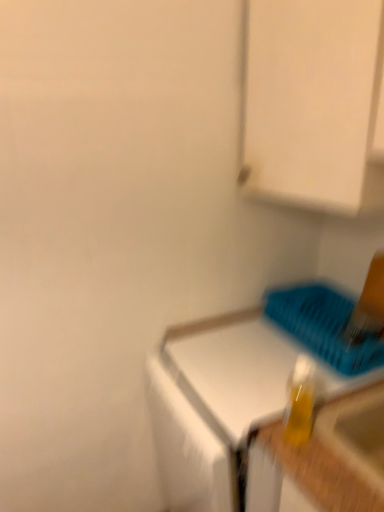
Question: Is translucent yellow bottle at lower right directly adjacent to white glossy countertop at center?

Choices:
 (A) no
 (B) yes

Answer: (A)

Question: From the image's perspective, is translucent yellow bottle at lower right beneath white glossy countertop at center?

Choices:
 (A) no
 (B) yes

Answer: (A)

Question: Is translucent yellow bottle at lower right shorter than white glossy countertop at center?

Choices:
 (A) yes
 (B) no

Answer: (A)

Question: Is translucent yellow bottle at lower right behind white glossy countertop at center?

Choices:
 (A) no
 (B) yes

Answer: (A)

Question: Would you say white glossy countertop at center is part of translucent yellow bottle at lower right's contents?

Choices:
 (A) yes
 (B) no

Answer: (B)

Question: Considering the positions of point (302, 403) and point (304, 126), is point (302, 403) closer or farther from the camera than point (304, 126)?

Choices:
 (A) farther
 (B) closer

Answer: (B)

Question: From a real-world perspective, is translucent yellow bottle at lower right positioned above or below white matte cabinet at upper right?

Choices:
 (A) below
 (B) above

Answer: (A)

Question: Choose the correct answer: Is translucent yellow bottle at lower right inside white matte cabinet at upper right or outside it?

Choices:
 (A) outside
 (B) inside

Answer: (A)

Question: Considering the positions of translucent yellow bottle at lower right and white matte cabinet at upper right in the image, is translucent yellow bottle at lower right taller or shorter than white matte cabinet at upper right?

Choices:
 (A) tall
 (B) short

Answer: (B)

Question: Is blue plastic basket at lower right situated inside white glossy countertop at center or outside?

Choices:
 (A) inside
 (B) outside

Answer: (B)

Question: Is point (314, 291) closer or farther from the camera than point (190, 496)?

Choices:
 (A) closer
 (B) farther

Answer: (B)

Question: Considering the relative positions of blue plastic basket at lower right and white glossy countertop at center in the image provided, is blue plastic basket at lower right to the left or to the right of white glossy countertop at center?

Choices:
 (A) right
 (B) left

Answer: (A)

Question: From a real-world perspective, is blue plastic basket at lower right positioned above or below white glossy countertop at center?

Choices:
 (A) above
 (B) below

Answer: (A)

Question: From the image's perspective, is white matte cabinet at upper right above or below white glossy countertop at center?

Choices:
 (A) below
 (B) above

Answer: (B)

Question: Which is correct: white matte cabinet at upper right is inside white glossy countertop at center, or outside of it?

Choices:
 (A) inside
 (B) outside

Answer: (B)